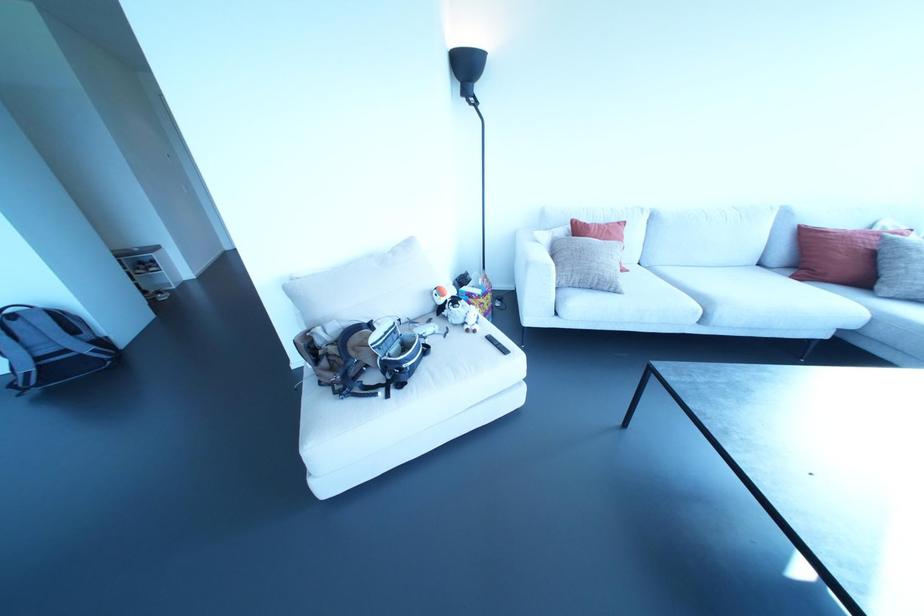
Where would you rest the sofa armrest? Please return your answer as a coordinate pair (x, y).

(538, 252)